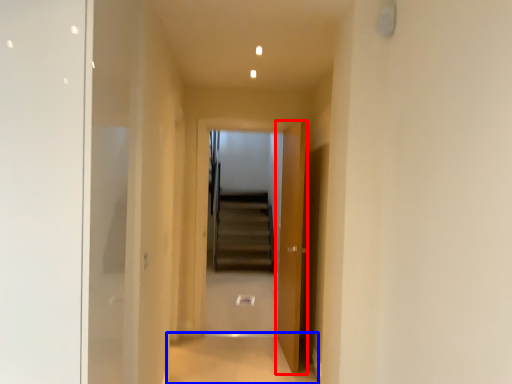
Question: Among these objects, which one is nearest to the camera, door (highlighted by a red box) or path (highlighted by a blue box)?

Choices:
 (A) door
 (B) path

Answer: (B)